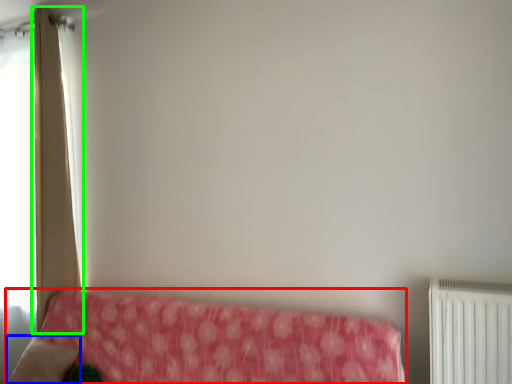
Question: Which object is positioned farthest from furniture (highlighted by a red box)? Select from pillow (highlighted by a blue box) and curtain (highlighted by a green box).

Choices:
 (A) pillow
 (B) curtain

Answer: (B)